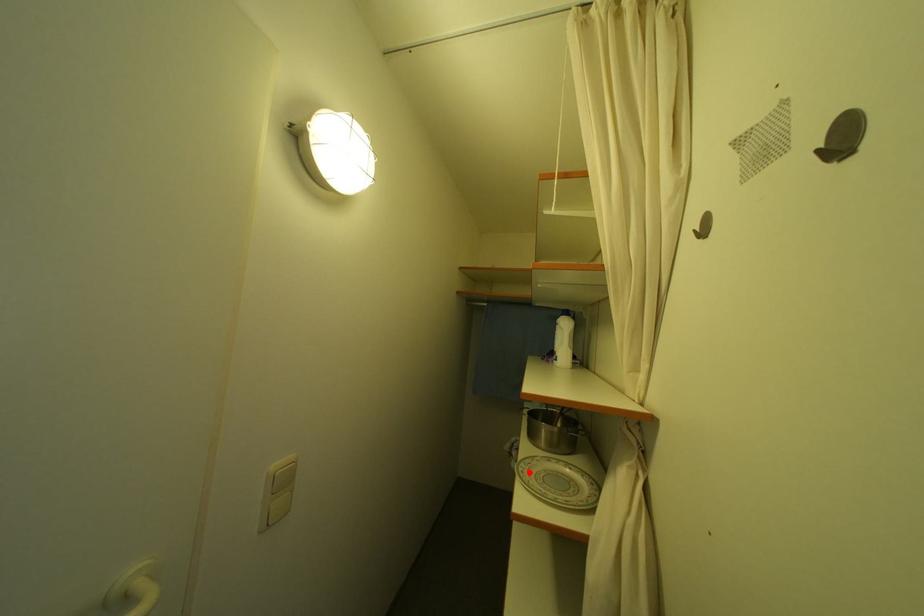
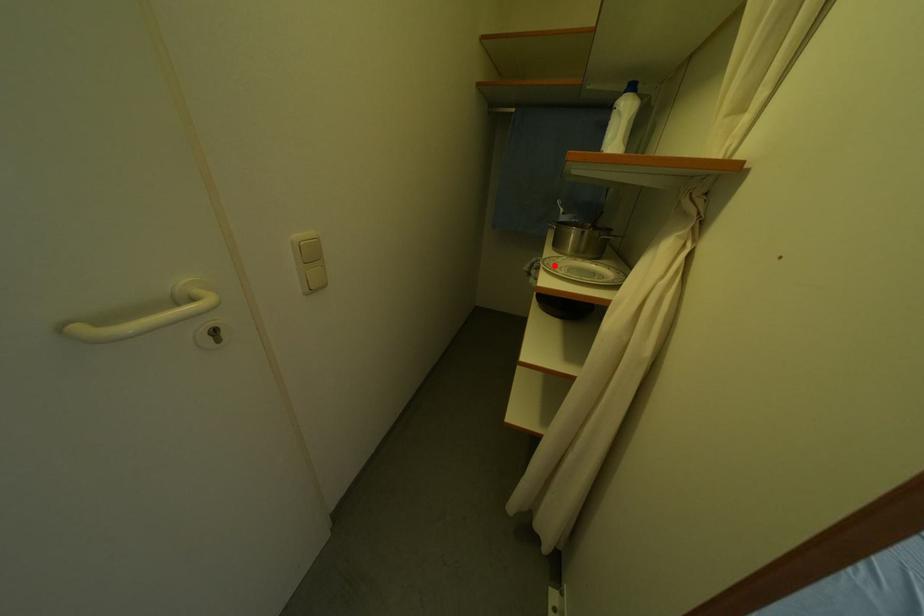
I am providing you with two images of the same scene from different viewpoints. A red point is marked on the first image and another point is marked on the second image. Is the marked point in image1 the same physical position as the marked point in image2?

Yes